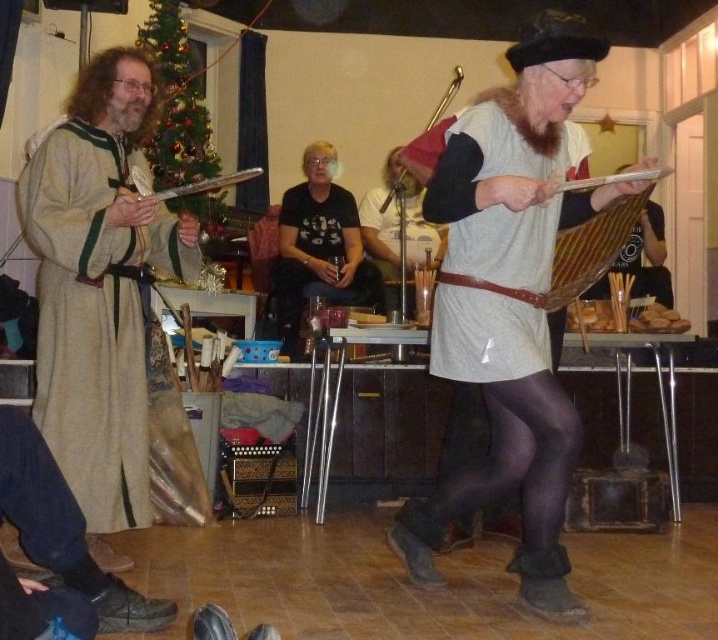
Question: Can you confirm if matte gray tunic at center is positioned to the right of matte black microphone at center?

Choices:
 (A) yes
 (B) no

Answer: (A)

Question: Which object is farther from the camera taking this photo?

Choices:
 (A) beige woolen robe at left
 (B) matte black microphone at center
 (C) black cotton shirt at center

Answer: (C)

Question: Which point is farther to the camera?

Choices:
 (A) (88, 230)
 (B) (465, 433)
 (C) (354, 262)

Answer: (C)

Question: Which point is farther to the camera?

Choices:
 (A) (578, 138)
 (B) (414, 208)
 (C) (325, 273)
 (D) (62, 458)

Answer: (B)

Question: Can you confirm if beige woolen robe at left is positioned to the right of matte black microphone at center?

Choices:
 (A) yes
 (B) no

Answer: (B)

Question: Considering the relative positions of black cotton shirt at center and matte black microphone at center in the image provided, where is black cotton shirt at center located with respect to matte black microphone at center?

Choices:
 (A) right
 (B) left

Answer: (B)